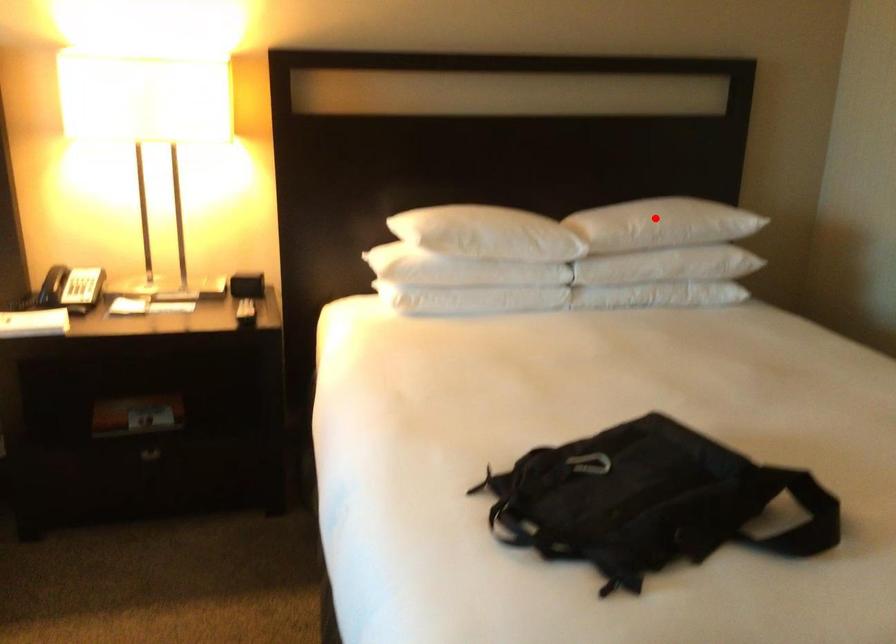
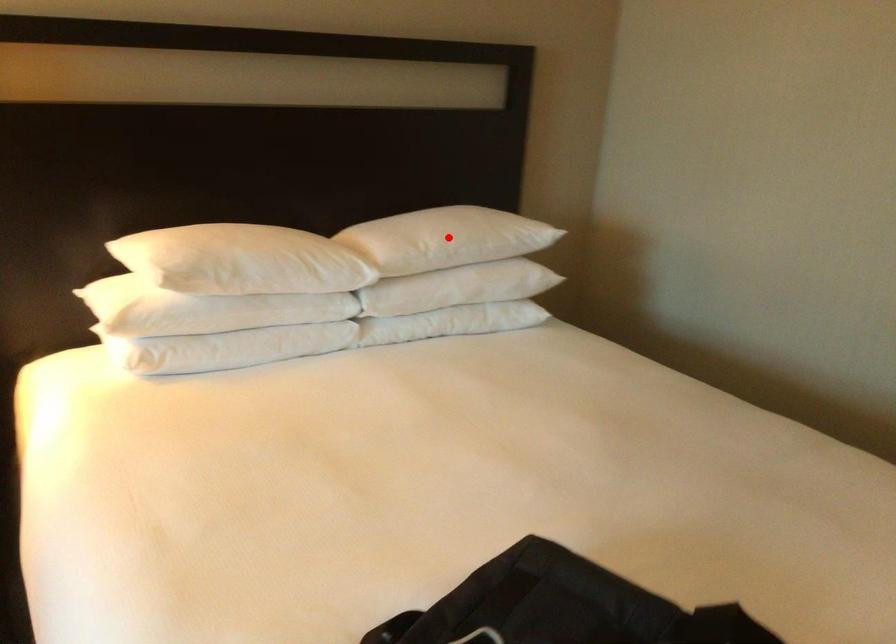
I am providing you with two images of the same scene from different viewpoints. A red point is marked on the first image and another point is marked on the second image. Is the marked point in image1 the same physical position as the marked point in image2?

Yes